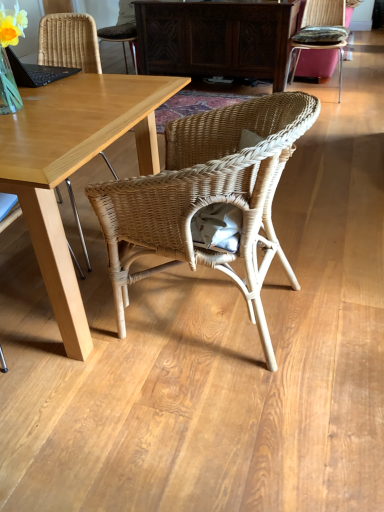
Question: Would you say woven wicker chair at center, which ranks as the 2th chair in back-to-front order, is outside rattan cushion at upper right, the 3th chair viewed from the front?

Choices:
 (A) no
 (B) yes

Answer: (B)

Question: Does woven wicker chair at center, which ranks as the 3th chair in right-to-left order, lie behind rattan cushion at upper right, acting as the third chair starting from the bottom?

Choices:
 (A) yes
 (B) no

Answer: (B)

Question: Considering the relative sizes of woven wicker chair at center, the 2th chair ordered from the bottom, and rattan cushion at upper right, which is the 1th chair from right to left, in the image provided, is woven wicker chair at center, the 2th chair ordered from the bottom, wider than rattan cushion at upper right, which is the 1th chair from right to left,?

Choices:
 (A) no
 (B) yes

Answer: (B)

Question: Is woven wicker chair at center, which ranks as the 2th chair in back-to-front order, thinner than rattan cushion at upper right, which is the first chair from top to bottom?

Choices:
 (A) no
 (B) yes

Answer: (A)

Question: From the image's perspective, is woven wicker chair at center, which ranks as the 2th chair in back-to-front order, below rattan cushion at upper right, which is the 1th chair from right to left?

Choices:
 (A) yes
 (B) no

Answer: (A)

Question: Is woven wicker chair at center, the second chair viewed from the top, positioned far away from rattan cushion at upper right, which appears as the 1th chair when viewed from the back?

Choices:
 (A) no
 (B) yes

Answer: (B)

Question: Is rattan cushion at upper right, acting as the third chair starting from the bottom, closer to the viewer compared to natural wicker chair at center, which is the third chair from back to front?

Choices:
 (A) no
 (B) yes

Answer: (A)

Question: From the image's perspective, is rattan cushion at upper right, acting as the third chair starting from the bottom, on top of natural wicker chair at center, which is counted as the 1th chair, starting from the bottom?

Choices:
 (A) yes
 (B) no

Answer: (A)

Question: Considering the relative positions of rattan cushion at upper right, the 3th chair viewed from the front, and natural wicker chair at center, which is the third chair from back to front, in the image provided, is rattan cushion at upper right, the 3th chair viewed from the front, to the left of natural wicker chair at center, which is the third chair from back to front, from the viewer's perspective?

Choices:
 (A) no
 (B) yes

Answer: (A)

Question: Is rattan cushion at upper right, arranged as the 3th chair when viewed from the left, further to the viewer compared to natural wicker chair at center, the second chair positioned from the right?

Choices:
 (A) no
 (B) yes

Answer: (B)

Question: From the image's perspective, is rattan cushion at upper right, which is the 1th chair from right to left, beneath natural wicker chair at center, which is the 1th chair from front to back?

Choices:
 (A) yes
 (B) no

Answer: (B)

Question: From a real-world perspective, is rattan cushion at upper right, which is the 1th chair from right to left, located beneath natural wicker chair at center, which is the 1th chair from front to back?

Choices:
 (A) yes
 (B) no

Answer: (B)

Question: Is rattan cushion at upper right, acting as the third chair starting from the bottom, smaller than dark wood cabinet at center?

Choices:
 (A) no
 (B) yes

Answer: (B)